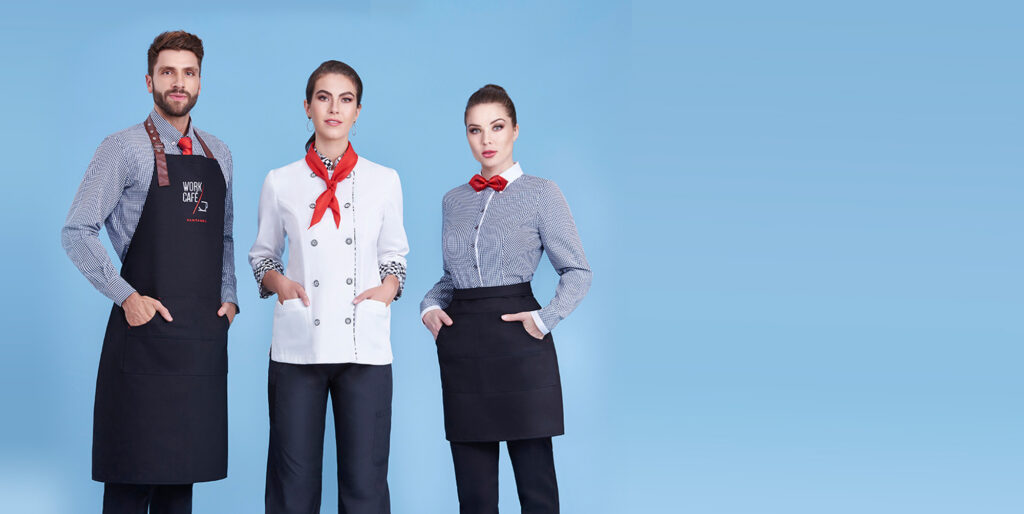
The height and width of the screenshot is (514, 1024). What are the coordinates of `light` in the screenshot? It's located at (822, 43).